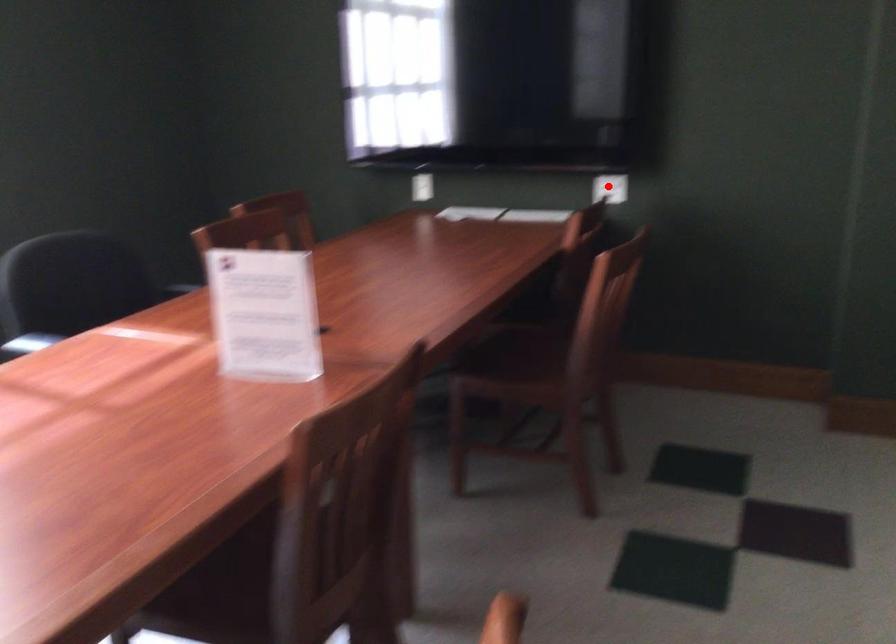
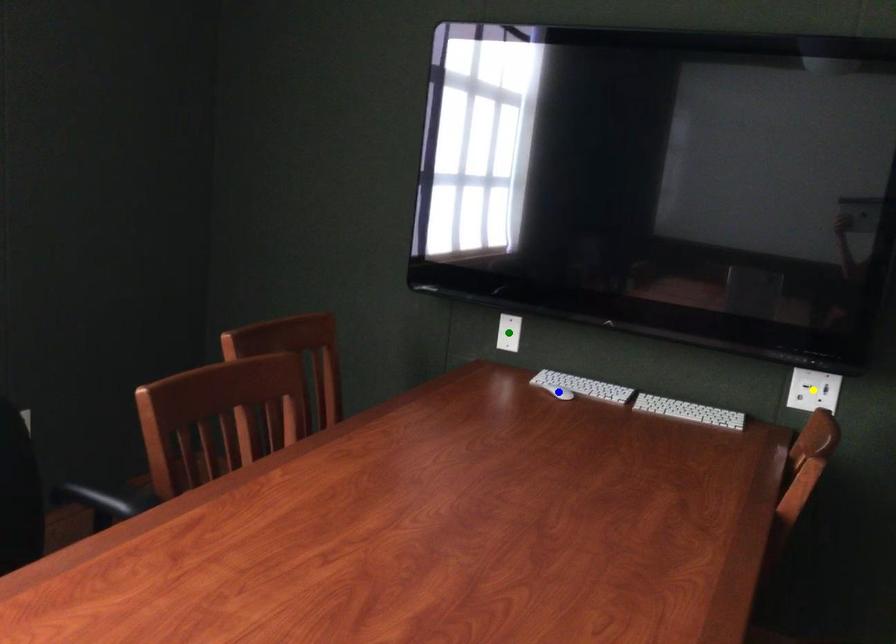
Question: I am providing you with two images of the same scene from different viewpoints. A red point is marked on the first image. You are given multiple points on the second image. Which mark in image 2 goes with the point in image 1?

Choices:
 (A) green point
 (B) yellow point
 (C) blue point

Answer: (B)